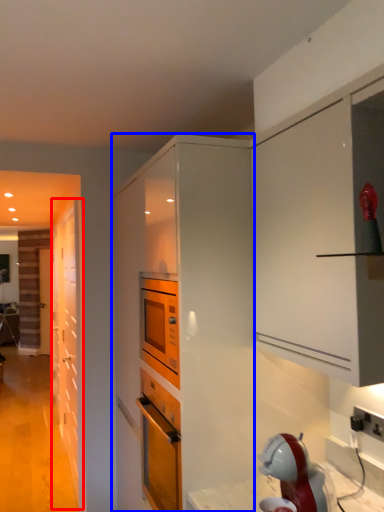
Question: Which of the following is the farthest to the observer, door (highlighted by a red box) or cabinetry (highlighted by a blue box)?

Choices:
 (A) door
 (B) cabinetry

Answer: (A)